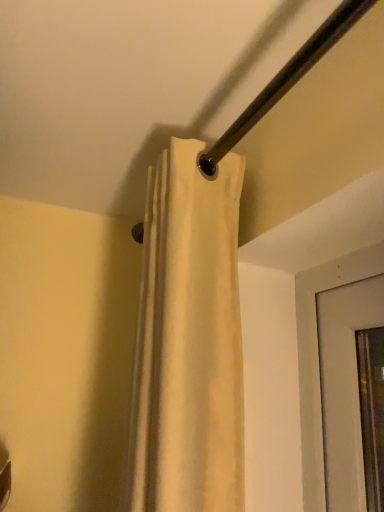
Question: Should I look upward or downward to see matte metal towel bar at upper center?

Choices:
 (A) up
 (B) down

Answer: (A)